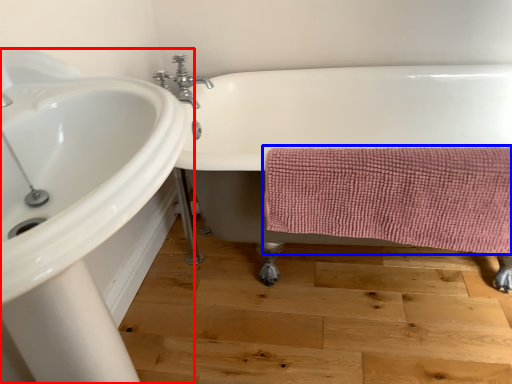
Question: Among these objects, which one is farthest to the camera, sink (highlighted by a red box) or bath towel (highlighted by a blue box)?

Choices:
 (A) sink
 (B) bath towel

Answer: (B)